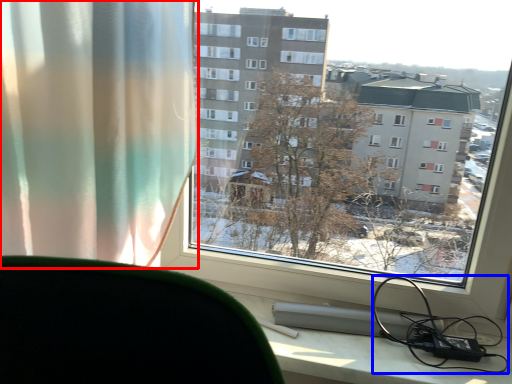
Question: Among these objects, which one is farthest to the camera, curtain (highlighted by a red box) or cable (highlighted by a blue box)?

Choices:
 (A) curtain
 (B) cable

Answer: (B)